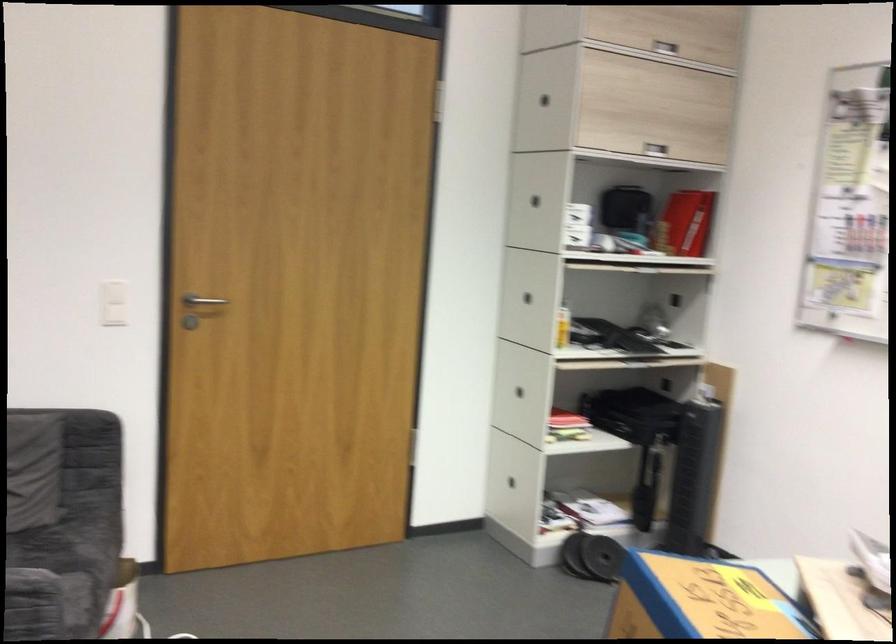
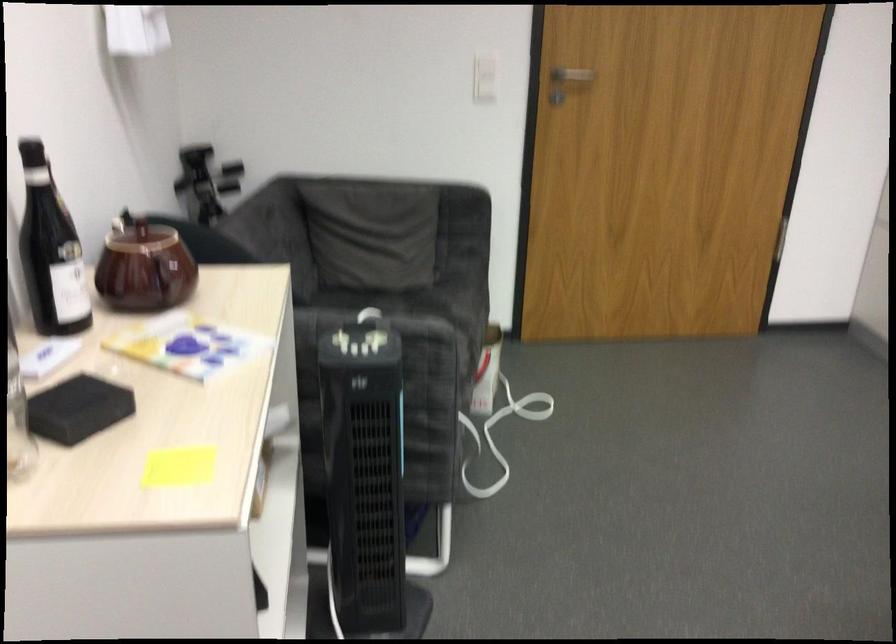
In the second image, find the point that corresponds to pixel 197 310 in the first image.

(569, 77)